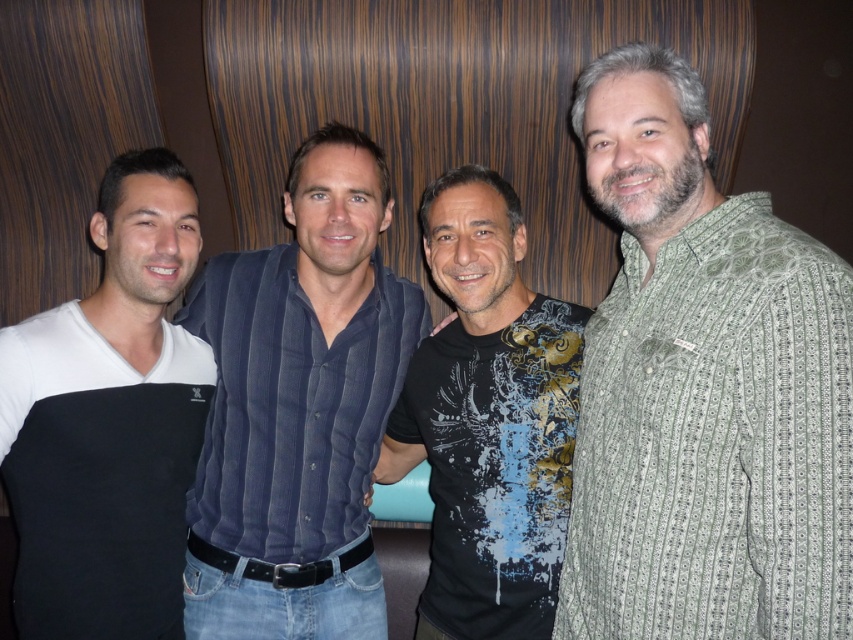
Can you confirm if dark blue corduroy shirt at center is shorter than white cotton t-shirt at left?

No, dark blue corduroy shirt at center is not shorter than white cotton t-shirt at left.

Which is in front, point (303, 326) or point (158, 321)?

Point (158, 321) is more forward.

Where is `dark blue corduroy shirt at center`? The height and width of the screenshot is (640, 853). dark blue corduroy shirt at center is located at coordinates (299, 408).

Find the location of `dark blue corduroy shirt at center`. dark blue corduroy shirt at center is located at coordinates (299, 408).

Which is more to the left, dark blue corduroy shirt at center or black printed t-shirt at center?

From the viewer's perspective, dark blue corduroy shirt at center appears more on the left side.

Between point (363, 307) and point (424, 406), which one is positioned in front?

Positioned in front is point (424, 406).

Identify the location of dark blue corduroy shirt at center. The height and width of the screenshot is (640, 853). (299, 408).

Which is below, green striped shirt at right or dark blue corduroy shirt at center?

Positioned lower is dark blue corduroy shirt at center.

Is the position of green striped shirt at right less distant than that of dark blue corduroy shirt at center?

Yes, it is.

Is point (851, 332) closer to camera compared to point (334, 572)?

Yes, it is in front of point (334, 572).

What are the coordinates of `green striped shirt at right` in the screenshot? It's located at (703, 388).